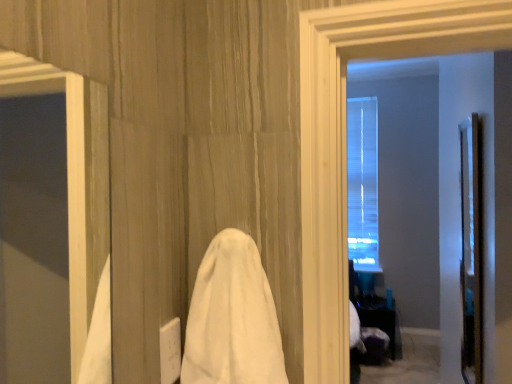
Question: Is white cloth at center situated inside clear glass door at right or outside?

Choices:
 (A) inside
 (B) outside

Answer: (B)

Question: Based on their sizes in the image, would you say white cloth at center is bigger or smaller than clear glass door at right?

Choices:
 (A) small
 (B) big

Answer: (A)

Question: Which object is positioned closest to the clear glass door at right?

Choices:
 (A) white cloth at center
 (B) black glossy table at lower right

Answer: (A)

Question: Which is nearer to the clear glass door at right?

Choices:
 (A) black glossy table at lower right
 (B) white cloth at center

Answer: (B)